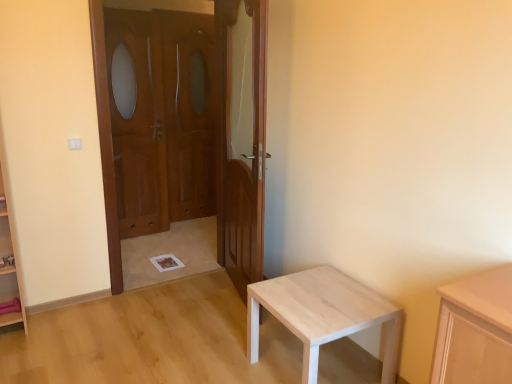
Question: From a real-world perspective, is wooden door at left, placed as the second door when sorted from right to left, physically below wooden screen door at center, the 1th screen door in the left-to-right sequence?

Choices:
 (A) no
 (B) yes

Answer: (B)

Question: Is wooden door at left, placed as the second door when sorted from right to left, looking in the opposite direction of wooden screen door at center, the 1th screen door in the left-to-right sequence?

Choices:
 (A) no
 (B) yes

Answer: (B)

Question: From a real-world perspective, is wooden door at left, which ranks as the first door in left-to-right order, on wooden screen door at center, the 1th screen door in the left-to-right sequence?

Choices:
 (A) yes
 (B) no

Answer: (B)

Question: Is wooden door at left, placed as the second door when sorted from right to left, at the left side of wooden screen door at center, the 1th screen door in the left-to-right sequence?

Choices:
 (A) no
 (B) yes

Answer: (A)

Question: Does wooden door at left, placed as the second door when sorted from right to left, have a greater width compared to wooden screen door at center, the 1th screen door in the left-to-right sequence?

Choices:
 (A) yes
 (B) no

Answer: (A)

Question: From a real-world perspective, relative to wooden screen door at center, the 1th screen door in the right-to-left sequence, is wooden door at left, placed as the second door when sorted from right to left, vertically above or below?

Choices:
 (A) above
 (B) below

Answer: (B)

Question: Considering the positions of wooden door at left, placed as the second door when sorted from right to left, and wooden screen door at center, the second screen door positioned from the left, in the image, is wooden door at left, placed as the second door when sorted from right to left, taller or shorter than wooden screen door at center, the second screen door positioned from the left,?

Choices:
 (A) tall
 (B) short

Answer: (B)

Question: Looking at their shapes, would you say wooden door at left, placed as the second door when sorted from right to left, is wider or thinner than wooden screen door at center, the 1th screen door in the right-to-left sequence?

Choices:
 (A) wide
 (B) thin

Answer: (A)

Question: In the image, is wooden door at left, placed as the second door when sorted from right to left, positioned in front of or behind wooden screen door at center, the 1th screen door in the right-to-left sequence?

Choices:
 (A) front
 (B) behind

Answer: (A)

Question: Looking at the image, does wooden at center, which is the 1th door in right-to-left order, seem bigger or smaller compared to wooden screen door at center, the 1th screen door in the left-to-right sequence?

Choices:
 (A) big
 (B) small

Answer: (A)

Question: Considering the positions of point (247, 221) and point (132, 211), is point (247, 221) closer or farther from the camera than point (132, 211)?

Choices:
 (A) farther
 (B) closer

Answer: (B)

Question: Is wooden at center, which is the 1th door in right-to-left order, wider or thinner than wooden screen door at center, which is the second screen door from right to left?

Choices:
 (A) wide
 (B) thin

Answer: (A)

Question: Relative to wooden screen door at center, the 1th screen door in the left-to-right sequence, is wooden at center, which is the 1th door in right-to-left order, in front or behind?

Choices:
 (A) behind
 (B) front

Answer: (B)

Question: Is point (276, 307) closer or farther from the camera than point (122, 221)?

Choices:
 (A) closer
 (B) farther

Answer: (A)

Question: From a real-world perspective, relative to wooden screen door at center, which is the second screen door from right to left, is light wood table at lower right vertically above or below?

Choices:
 (A) above
 (B) below

Answer: (B)